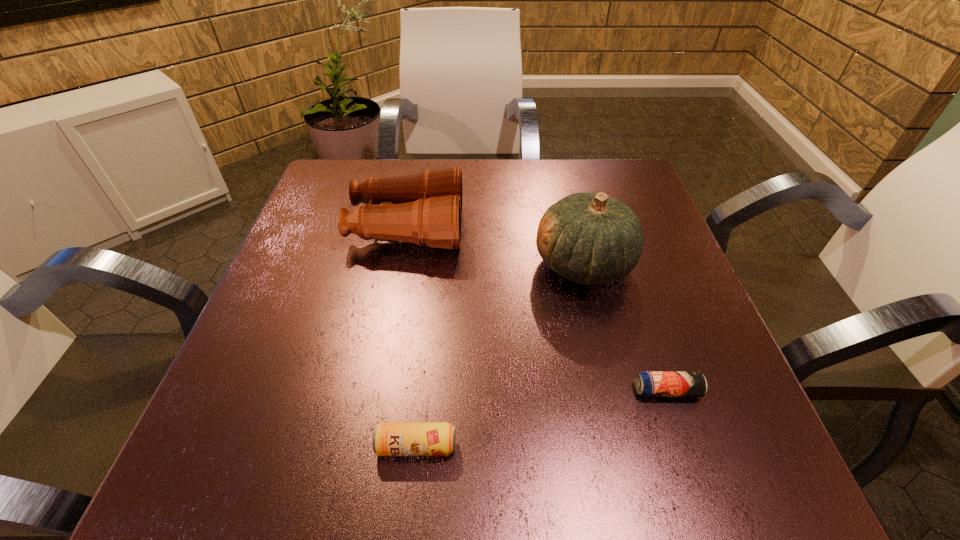
You are a GUI agent. You are given a task and a screenshot of the screen. Output one action in this format:
    pyautogui.click(x=<x>, y=<y>)
    Task: Click on the free space in the image that satisfies the following two spatial constraints: 1. through the lenses of the binoculars; 2. on the left side of the farther beer can
    Image resolution: width=960 pixels, height=540 pixels.
    Given the screenshot: What is the action you would take?
    [x=377, y=391]

The height and width of the screenshot is (540, 960). In order to click on free location that satisfies the following two spatial constraints: 1. on the back side of the left beer can; 2. on the right side of the gourd in this screenshot , I will do `click(436, 265)`.